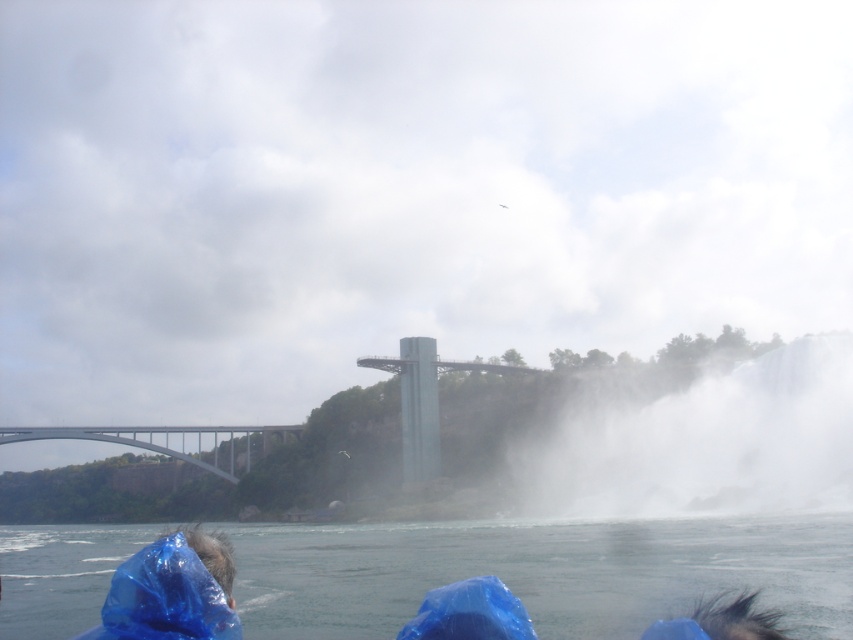
Who is taller, white mist at lower right or blue plastic bag at lower left?

white mist at lower right is taller.

Which is in front, point (788, 493) or point (165, 573)?

Positioned in front is point (165, 573).

The height and width of the screenshot is (640, 853). What are the coordinates of `white mist at lower right` in the screenshot? It's located at (701, 444).

Which is in front, point (173, 541) or point (67, 428)?

Positioned in front is point (173, 541).

Locate an element on the screen. Image resolution: width=853 pixels, height=640 pixels. blue plastic bag at lower left is located at coordinates (172, 592).

Which is below, transparent plastic water at lower center or white mist at lower right?

transparent plastic water at lower center is lower down.

Can you confirm if transparent plastic water at lower center is wider than white mist at lower right?

Correct, the width of transparent plastic water at lower center exceeds that of white mist at lower right.

Is point (527, 588) positioned after point (572, 460)?

That is False.

This screenshot has width=853, height=640. I want to click on transparent plastic water at lower center, so click(541, 572).